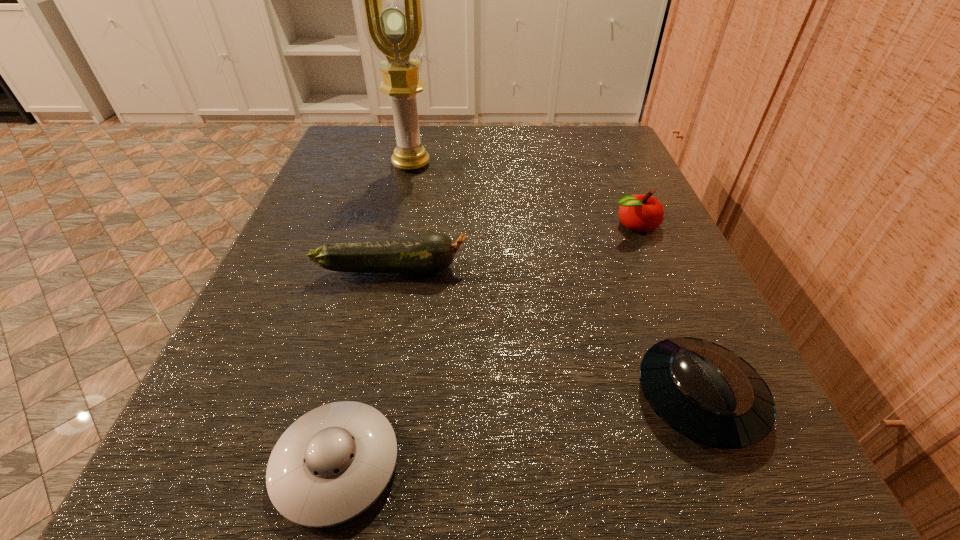
Identify the location of object positioned at the near right corner. This screenshot has height=540, width=960. (709, 394).

What are the coordinates of `vacant position at the far edge of the desktop` in the screenshot? It's located at (527, 166).

Locate an element on the screen. vacant space at the near edge is located at coordinates (517, 536).

Find the location of a particular element. This screenshot has height=540, width=960. vacant space at the left edge of the desktop is located at coordinates 344,305.

Locate an element on the screen. This screenshot has height=540, width=960. free space at the right edge of the desktop is located at coordinates (673, 303).

Where is `vacant region at the far left corner of the desktop`? This screenshot has width=960, height=540. vacant region at the far left corner of the desktop is located at coordinates tap(398, 177).

The width and height of the screenshot is (960, 540). I want to click on free space at the near left corner of the desktop, so click(159, 512).

This screenshot has height=540, width=960. What are the coordinates of `free space at the far right corner` in the screenshot? It's located at (624, 137).

Where is `free space at the near right corner`? This screenshot has width=960, height=540. free space at the near right corner is located at coordinates (754, 453).

Find the location of a particular element. vacant area that lies between the third nearest object and the second farthest object is located at coordinates (513, 246).